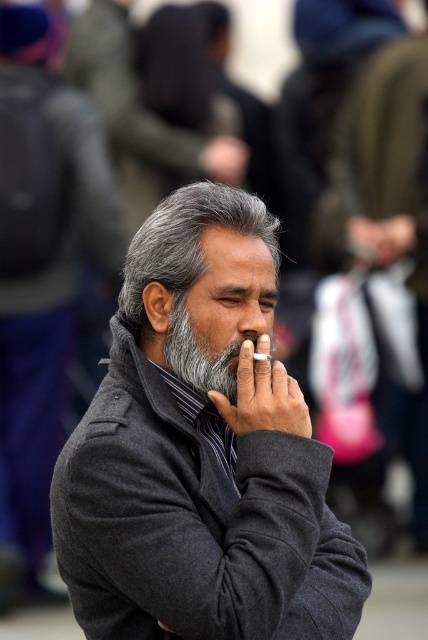
From the picture: You are a photographer who wants to capture a closeup of the dark gray wool coat at center. The camera you are using has a maximum focus distance of 10 feet. Can you take the photo without moving closer?

The dark gray wool coat at center and camera are 12.87 feet apart, which is beyond the camera maximum focus distance of 10 feet. You need to move closer to take the photo.

What are the coordinates of the gray wool coat at center?

The gray wool coat at center is located at coordinates point (x=41, y=269).